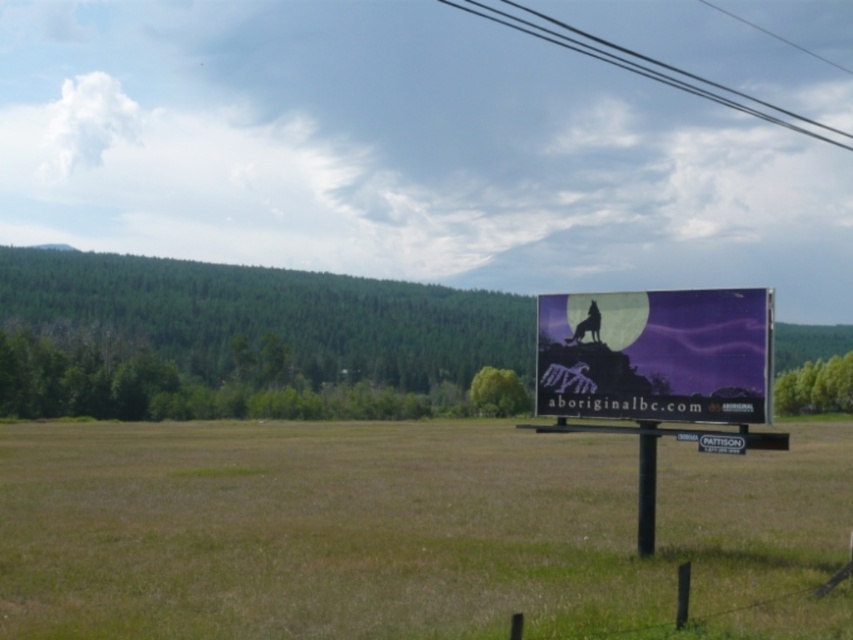
Does purple glossy billboard at center have a greater width compared to black wire at upper center?

Incorrect, purple glossy billboard at center's width does not surpass black wire at upper center's.

Is purple glossy billboard at center to the left of black wire at upper center from the viewer's perspective?

Yes, purple glossy billboard at center is to the left of black wire at upper center.

Which is behind, point (718, 291) or point (486, 16)?

Positioned behind is point (486, 16).

At what (x,y) coordinates should I click in order to perform the action: click on purple glossy billboard at center. Please return your answer as a coordinate pair (x, y). This screenshot has width=853, height=640. Looking at the image, I should click on (656, 355).

Who is taller, purple glossy billboard at center or black plastic pole at center?

purple glossy billboard at center

Between purple glossy billboard at center and black plastic pole at center, which one is positioned higher?

purple glossy billboard at center

Between point (556, 330) and point (651, 508), which one is positioned in front?

Point (651, 508)

You are a GUI agent. You are given a task and a screenshot of the screen. Output one action in this format:
    pyautogui.click(x=<x>, y=<y>)
    Task: Click on the purple glossy billboard at center
    The image size is (853, 640).
    Given the screenshot: What is the action you would take?
    pyautogui.click(x=656, y=355)

Can you confirm if black wire at upper center is bigger than black plastic pole at center?

Yes, black wire at upper center is bigger than black plastic pole at center.

Can you confirm if black wire at upper center is positioned to the right of black plastic pole at center?

Indeed, black wire at upper center is positioned on the right side of black plastic pole at center.

Measure the distance between point (453, 1) and camera.

A distance of 741.36 feet exists between point (453, 1) and camera.

In order to click on black wire at upper center in this screenshot , I will do `click(643, 65)`.